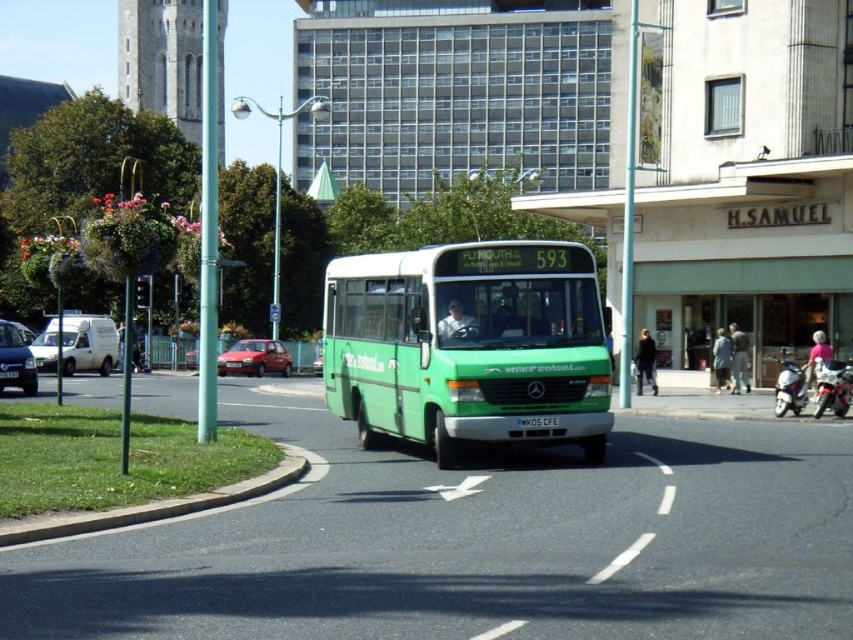
Question: Is shiny red car at center above white plastic license plate at center?

Choices:
 (A) no
 (B) yes

Answer: (A)

Question: Considering the real-world distances, which object is closest to the metallic silver car at left?

Choices:
 (A) white plastic license plate at center
 (B) green matte bus at center
 (C) matte red car at center
 (D) shiny red car at center

Answer: (A)

Question: Considering the relative positions of white matte van at left and matte red car at center in the image provided, where is white matte van at left located with respect to matte red car at center?

Choices:
 (A) below
 (B) above

Answer: (B)

Question: Can you confirm if green matte bus at center is positioned to the left of white plastic license plate at center?

Choices:
 (A) yes
 (B) no

Answer: (B)

Question: Considering the real-world distances, which object is closest to the matte red car at center?

Choices:
 (A) white plastic license plate at center
 (B) metallic silver car at left
 (C) green matte bus at center
 (D) shiny red car at center

Answer: (D)

Question: Which object is positioned closest to the metallic silver car at left?

Choices:
 (A) white plastic license plate at center
 (B) green matte bus at center
 (C) white matte van at left

Answer: (C)